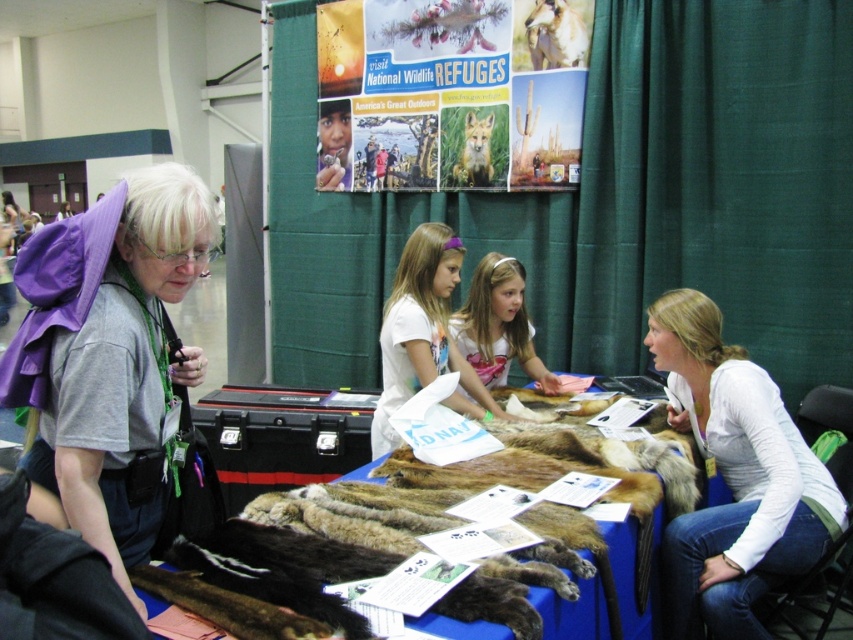
Question: Is brown fur at center above brown fur pelt at upper center?

Choices:
 (A) no
 (B) yes

Answer: (A)

Question: Which point is closer to the camera taking this photo?

Choices:
 (A) (563, 36)
 (B) (469, 358)

Answer: (B)

Question: Which is nearer to the brown fur pelt at upper center?

Choices:
 (A) white t-shirt at center
 (B) white soft fur at right
 (C) brown fur at center

Answer: (A)

Question: Is brown fur at center to the left of white soft fur at right from the viewer's perspective?

Choices:
 (A) yes
 (B) no

Answer: (A)

Question: Is smooth brown fur at center to the left of brown fur pelt at upper center from the viewer's perspective?

Choices:
 (A) no
 (B) yes

Answer: (B)

Question: Estimate the real-world distances between objects in this image. Which object is farther from the brown fur at center?

Choices:
 (A) smooth brown fur at center
 (B) white soft fur at right

Answer: (A)